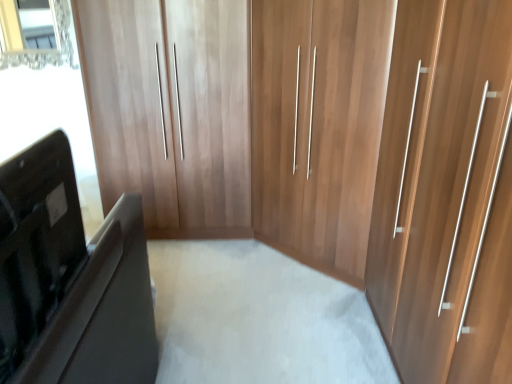
Question: From the image's perspective, is matte black laptop at left positioned above or below clear glass mirror at upper left?

Choices:
 (A) above
 (B) below

Answer: (B)

Question: In terms of height, does matte black laptop at left look taller or shorter compared to clear glass mirror at upper left?

Choices:
 (A) short
 (B) tall

Answer: (A)

Question: Choose the correct answer: Is matte black laptop at left inside clear glass mirror at upper left or outside it?

Choices:
 (A) inside
 (B) outside

Answer: (B)

Question: Is clear glass mirror at upper left taller or shorter than matte black laptop at left?

Choices:
 (A) short
 (B) tall

Answer: (B)

Question: From the image's perspective, is clear glass mirror at upper left located above or below matte black laptop at left?

Choices:
 (A) below
 (B) above

Answer: (B)

Question: From a real-world perspective, is clear glass mirror at upper left above or below matte black laptop at left?

Choices:
 (A) above
 (B) below

Answer: (A)

Question: In the image, is clear glass mirror at upper left positioned in front of or behind matte black laptop at left?

Choices:
 (A) behind
 (B) front

Answer: (A)